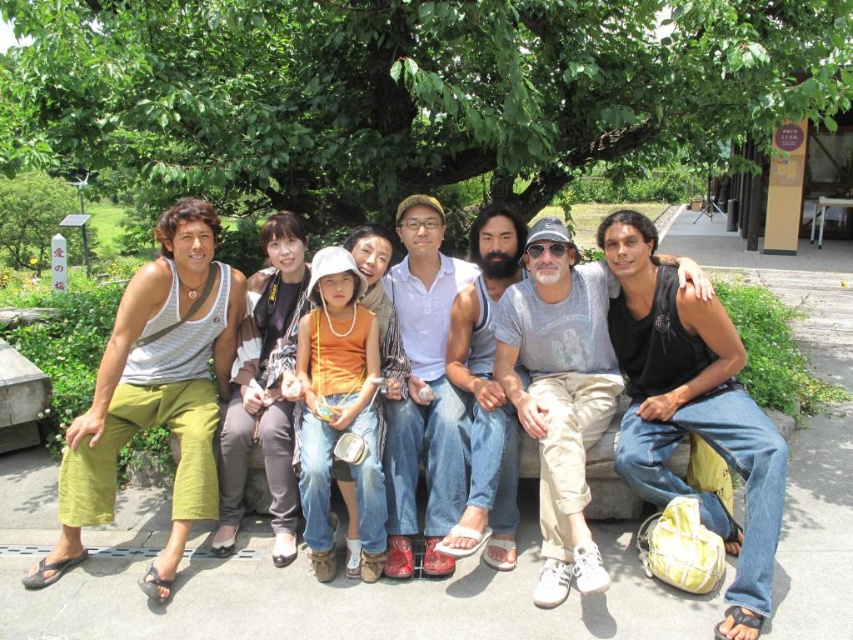
Who is taller, green leafy tree at upper center or green leafy tree at left?

green leafy tree at left is taller.

Which is below, green leafy tree at upper center or green leafy tree at left?

green leafy tree at upper center

Who is more forward, (167, 97) or (54, 186)?

Point (167, 97)

Where is `green leafy tree at upper center`? This screenshot has width=853, height=640. green leafy tree at upper center is located at coordinates [x=416, y=88].